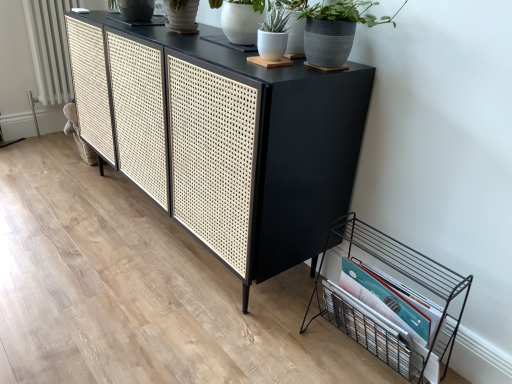
Question: Is white matte pot at upper center, acting as the 1th houseplant starting from the left, smaller than white textured radiator at left?

Choices:
 (A) yes
 (B) no

Answer: (A)

Question: Can you confirm if white matte pot at upper center, acting as the 1th houseplant starting from the left, is wider than white textured radiator at left?

Choices:
 (A) no
 (B) yes

Answer: (B)

Question: Considering the relative positions of white matte pot at upper center, acting as the 1th houseplant starting from the left, and white textured radiator at left in the image provided, is white matte pot at upper center, acting as the 1th houseplant starting from the left, behind white textured radiator at left?

Choices:
 (A) no
 (B) yes

Answer: (A)

Question: Is white matte pot at upper center, acting as the 1th houseplant starting from the left, located outside white textured radiator at left?

Choices:
 (A) no
 (B) yes

Answer: (B)

Question: Would you consider white matte pot at upper center, which is the second houseplant from right to left, to be distant from white textured radiator at left?

Choices:
 (A) no
 (B) yes

Answer: (B)

Question: Is white matte pot at upper center, which is the second houseplant from right to left, closer to camera compared to white textured radiator at left?

Choices:
 (A) no
 (B) yes

Answer: (B)

Question: Is white matte pot at upper center, which is the second houseplant from right to left, at the back of black wire magazine rack at lower right?

Choices:
 (A) yes
 (B) no

Answer: (B)

Question: Is the position of black wire magazine rack at lower right more distant than that of white matte pot at upper center, acting as the 1th houseplant starting from the left?

Choices:
 (A) no
 (B) yes

Answer: (A)

Question: Can we say black wire magazine rack at lower right lies outside white matte pot at upper center, which is the second houseplant from right to left?

Choices:
 (A) yes
 (B) no

Answer: (A)

Question: Is black wire magazine rack at lower right next to white matte pot at upper center, acting as the 1th houseplant starting from the left?

Choices:
 (A) yes
 (B) no

Answer: (B)

Question: Does black wire magazine rack at lower right have a greater width compared to white matte pot at upper center, acting as the 1th houseplant starting from the left?

Choices:
 (A) no
 (B) yes

Answer: (B)

Question: Is black wire magazine rack at lower right shorter than white matte pot at upper center, acting as the 1th houseplant starting from the left?

Choices:
 (A) yes
 (B) no

Answer: (B)

Question: Is the position of black wire magazine rack at lower right more distant than that of white textured radiator at left?

Choices:
 (A) yes
 (B) no

Answer: (B)